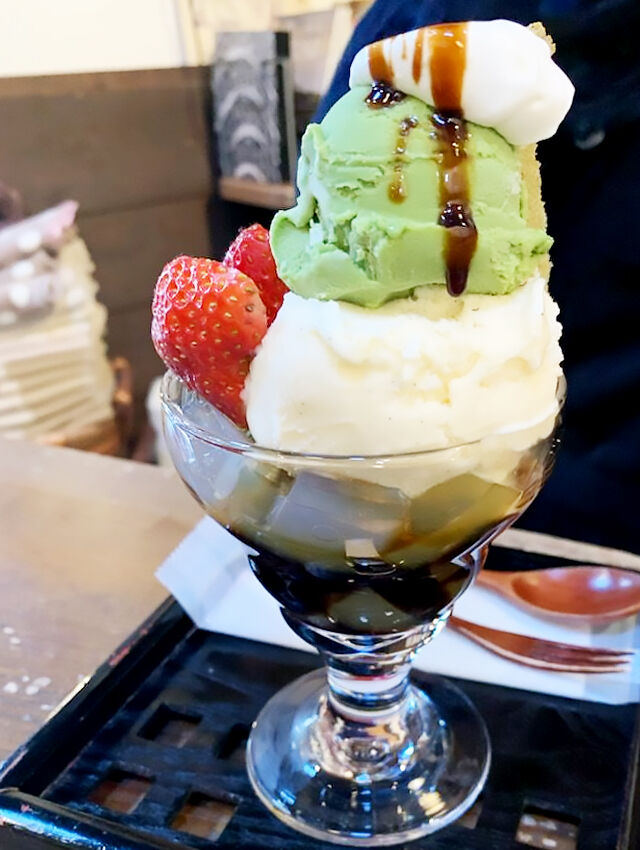
At what (x,y) coordinates should I click in order to perform the action: click on white napkin. Please return your answer as a coordinate pair (x, y). This screenshot has height=850, width=640. Looking at the image, I should click on (484, 666).